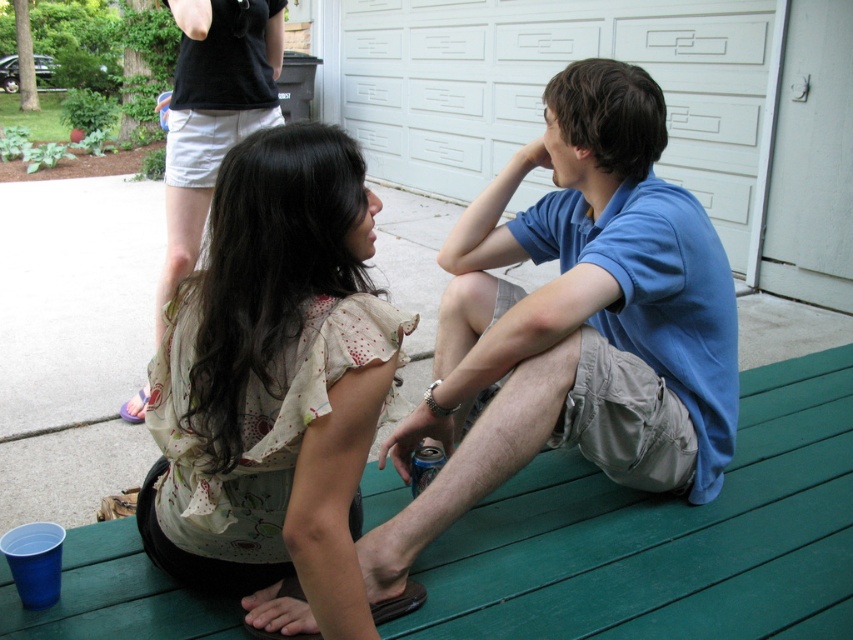
You are a photographer setting up a shot of the two people on the green wooden deck. You want to ensure the floral cotton blouse at center is clearly visible without being blocked by the white textured garage door at upper center. Is the current arrangement suitable?

Yes, the current arrangement is suitable because the floral cotton blouse at center is in front of the white textured garage door at upper center, so it won not be blocked by the door.

You are a photographer setting up a shot of the two people on the green wooden deck. You want to ensure the blue cotton shirt at center and the white textured garage door at upper center are both visible in the frame. Which object should you position lower in the photo to include both?

You should position the blue cotton shirt at center lower in the photo since it is already located below the white textured garage door at upper center, allowing both to be captured in the frame.